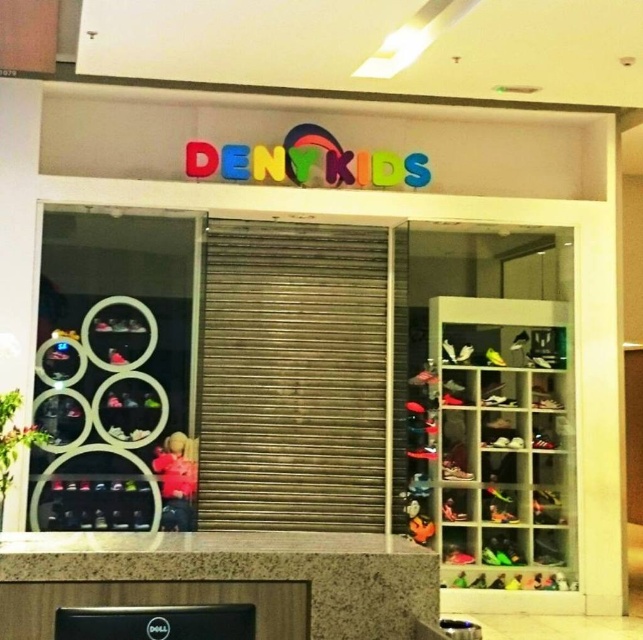
You are standing in front of the store and see two points marked on the window. The first point is at coordinate point [534,513] and the second is at point [156,452]. Which point is closer to you?

Point [156,452] is closer to you because it is in front of point [534,513].

You are standing in front of the store entrance. A child wants to reach a pair of shoes displayed at point (457, 308). The child is 3.5 feet tall. Can the child reach the shoes?

The point (457, 308) is 20.50 feet away from the viewer. Since the child is only 3.5 feet tall, they cannot reach the shoes at that distance.

Based on the photo, you are a parent trying to buy a gift for your child. You see the shiny plastic shoes at right and the pink fabric doll at center in the store window. Which item is taller?

The shiny plastic shoes at right are much taller than the pink fabric doll at center.